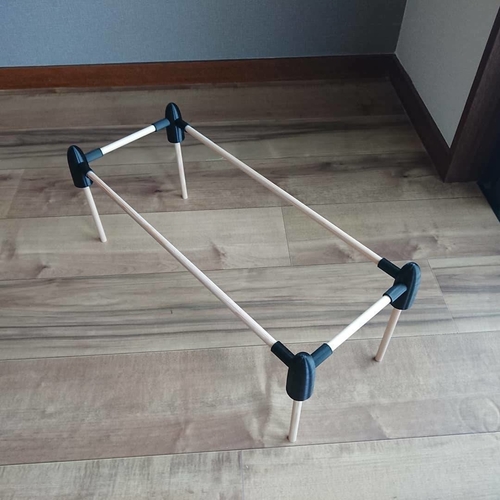
Image resolution: width=500 pixels, height=500 pixels. Identify the location of shadowed corner. (370, 26).